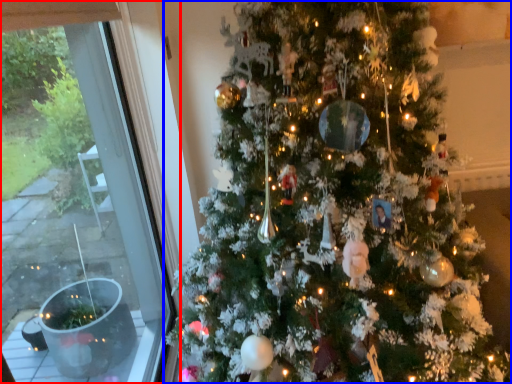
Question: Among these objects, which one is nearest to the camera, window (highlighted by a red box) or christmas tree (highlighted by a blue box)?

Choices:
 (A) window
 (B) christmas tree

Answer: (B)